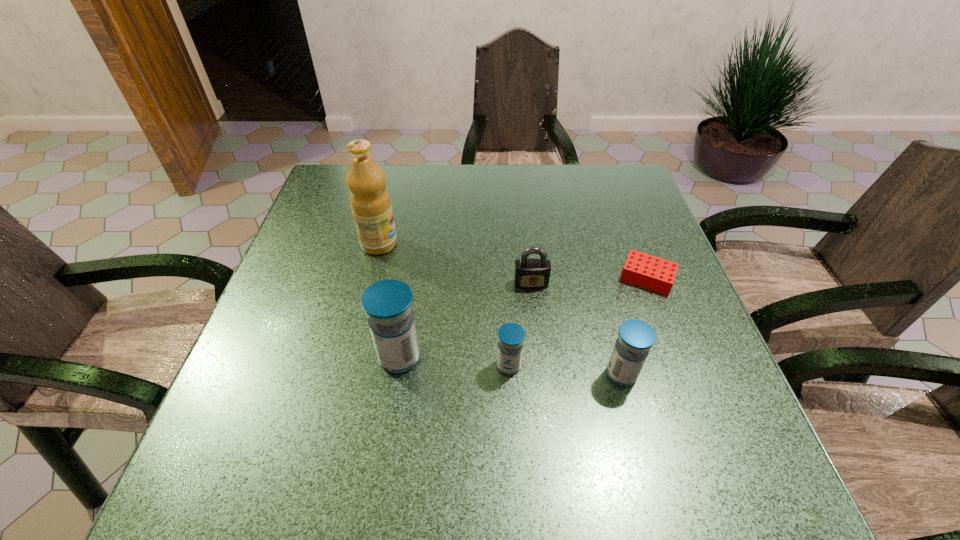
Locate an element on the screen. The height and width of the screenshot is (540, 960). free spot between the leftmost object and the padlock is located at coordinates (455, 264).

Identify the location of empty space that is in between the Lego and the tallest medicine. (523, 318).

You are a GUI agent. You are given a task and a screenshot of the screen. Output one action in this format:
    pyautogui.click(x=<x>, y=<y>)
    Task: Click on the blank region between the fifth shortest object and the second medicine from left to right
    
    Given the screenshot: What is the action you would take?
    pyautogui.click(x=454, y=361)

Find the location of a particular element. This screenshot has width=960, height=540. vacant point located between the rightmost medicine and the padlock is located at coordinates click(576, 329).

Identify the location of vacant space that is in between the shortest medicine and the second object from right to left. The width and height of the screenshot is (960, 540). (565, 370).

Locate an element on the screen. This screenshot has width=960, height=540. empty space between the padlock and the shortest medicine is located at coordinates (520, 325).

This screenshot has width=960, height=540. I want to click on the second closest object to the farthest object, so click(531, 273).

The image size is (960, 540). I want to click on object identified as the third closest to the rightmost object, so click(511, 336).

Find the location of `medicine identified as the closest to the padlock`. medicine identified as the closest to the padlock is located at coordinates (511, 336).

Identify the location of medicine that is the second closest to the rightmost medicine. The height and width of the screenshot is (540, 960). (388, 304).